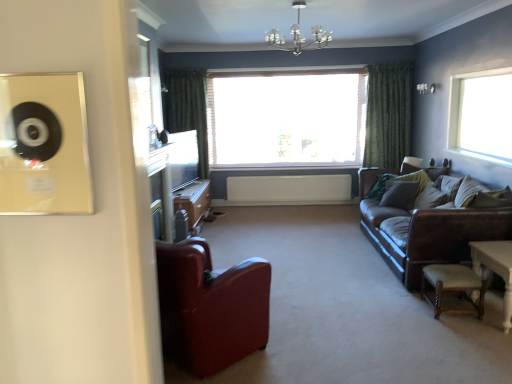
Identify the location of vacant area that is in front of beige woven stool at lower right. (472, 338).